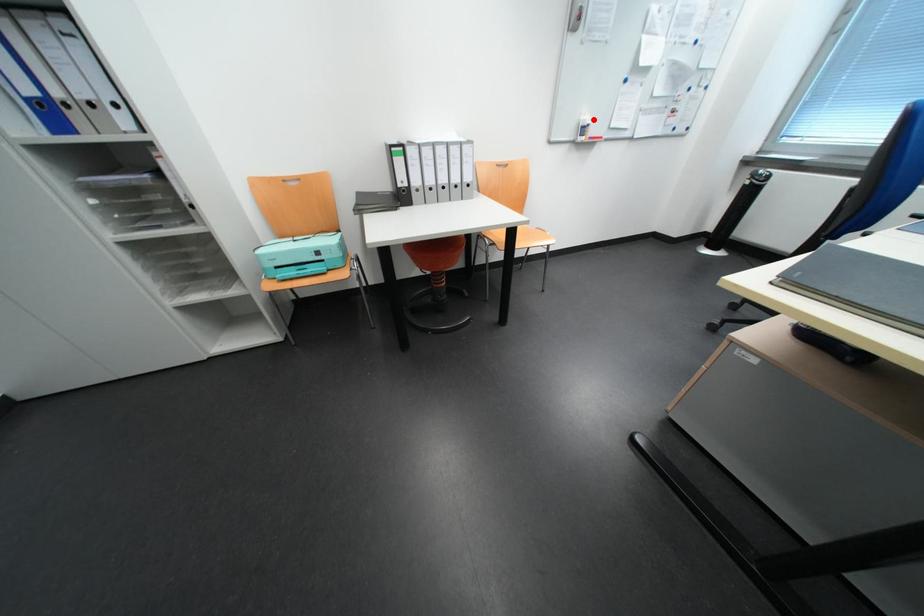
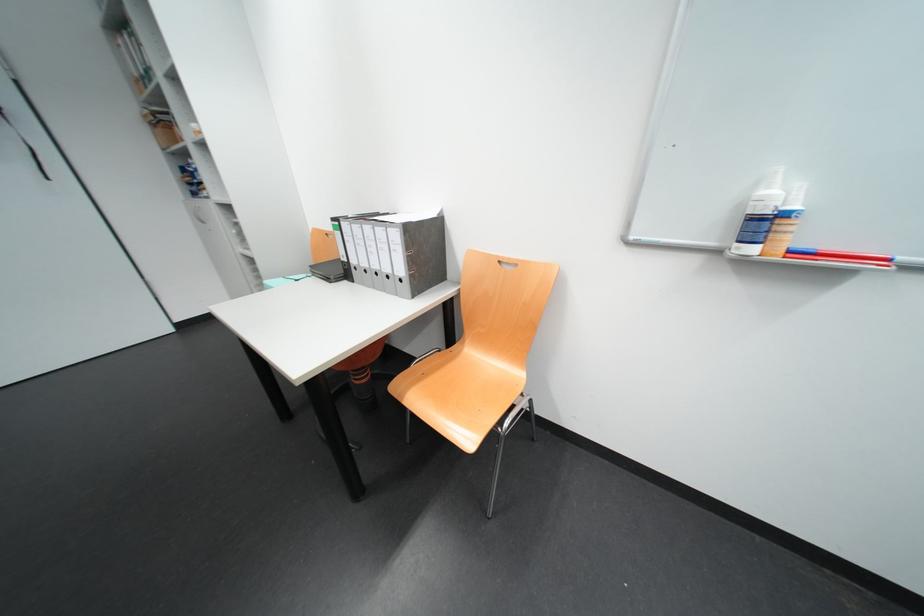
Question: I am providing you with two images of the same scene from different viewpoints. Image1 has a red point marked. In image2, the corresponding 3D location appears at what relative position? Reply with the corresponding letter.

Choices:
 (A) Closer
 (B) Farther

Answer: (B)